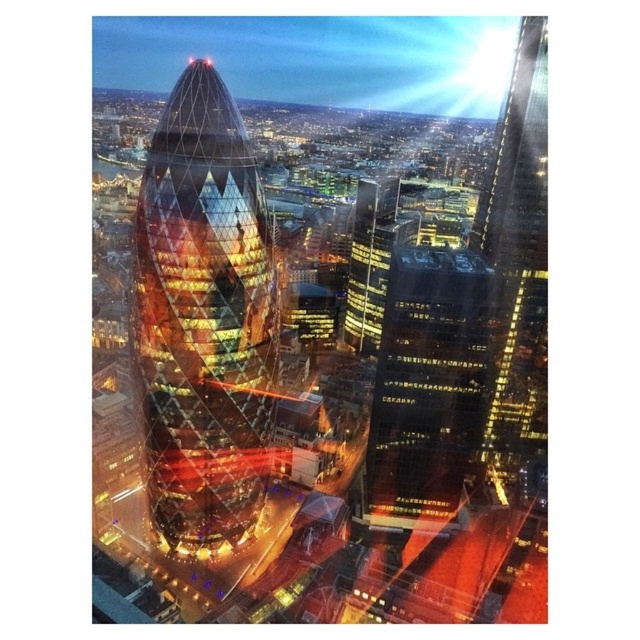
From the picture: You are standing at the center of the city square and see the point marked at coordinates point (204,320). What does this point indicate?

The point (204,320) corresponds to the shiny glass tower at center, which is the focal point of the cityscape with its cone shape and reflective facade.

You are an architect evaluating two glassy skyscrapers in the city. You need to determine which one is taller. You see the glassy reflective skyscraper at center and the glassy skyscraper at upper right. Which one is taller?

The glassy reflective skyscraper at center is taller than the glassy skyscraper at upper right.

You are an architect analyzing the city layout. You observe the glassy reflective skyscraper at center and the glassy skyscraper at upper right. Which of these two skyscrapers is positioned higher in the image?

The glassy skyscraper at upper right is positioned higher in the image than the glassy reflective skyscraper at center.